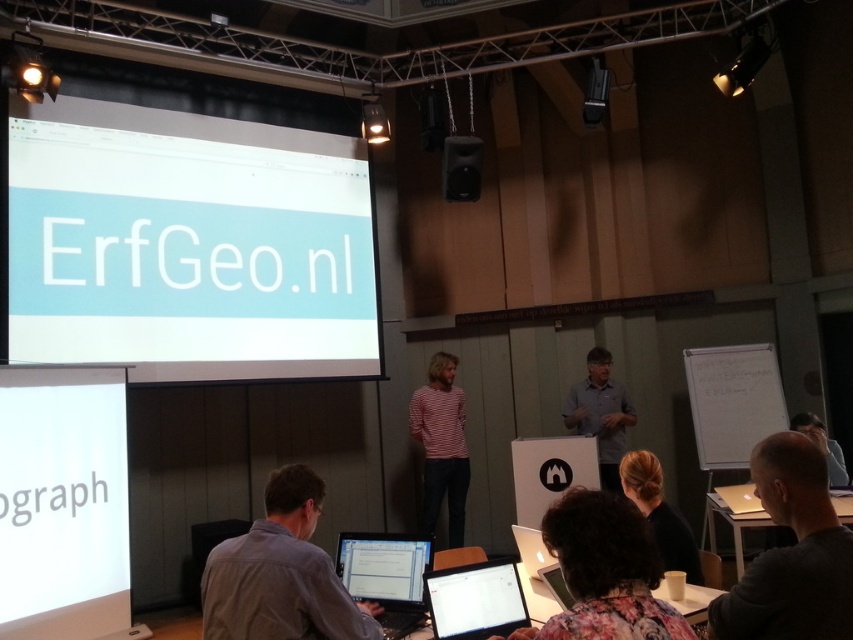
Who is shorter, black glossy laptop at center or gray matte shirt at center?

Standing shorter between the two is black glossy laptop at center.

Between black glossy laptop at center and gray matte shirt at center, which one appears on the right side from the viewer's perspective?

gray matte shirt at center is more to the right.

Between point (483, 573) and point (596, 376), which one is positioned behind?

Positioned behind is point (596, 376).

Image resolution: width=853 pixels, height=640 pixels. I want to click on black glossy laptop at center, so click(474, 600).

Which is more to the left, light blue matte projection screen at upper left or dark blue shirt at lower right?

Positioned to the left is light blue matte projection screen at upper left.

The image size is (853, 640). Identify the location of light blue matte projection screen at upper left. (189, 244).

Locate an element on the screen. light blue matte projection screen at upper left is located at coordinates (189, 244).

Can you confirm if gray shirt at lower center is positioned to the right of black hair at center?

Incorrect, gray shirt at lower center is not on the right side of black hair at center.

Is gray shirt at lower center thinner than black hair at center?

No, gray shirt at lower center is not thinner than black hair at center.

Identify the location of gray shirt at lower center. This screenshot has width=853, height=640. (281, 573).